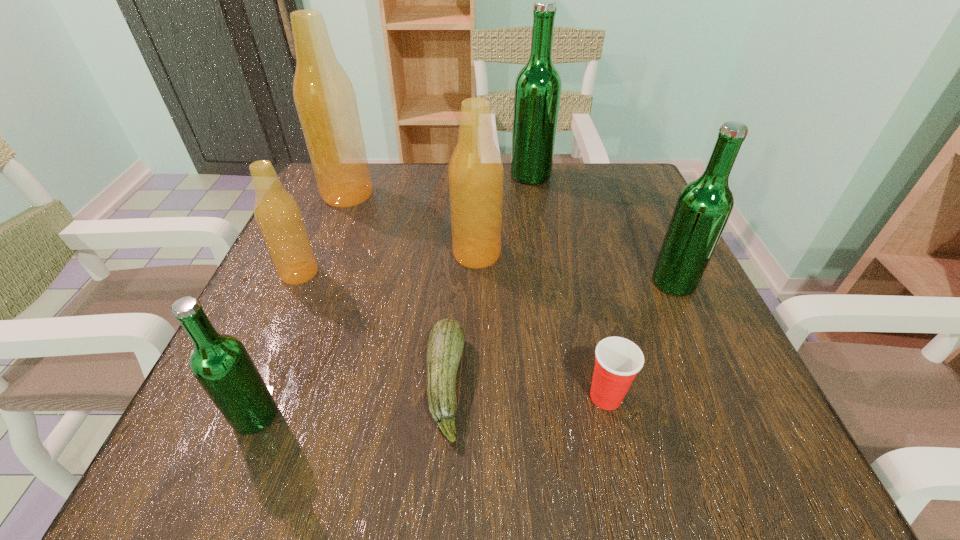
At what (x,y) coordinates should I click in order to perform the action: click on free location located 0.100m on the back of the red Dixie cup. Please return your answer as a coordinate pair (x, y). This screenshot has width=960, height=540. Looking at the image, I should click on (589, 327).

Identify the location of free space located at the stem end of the green zucchini. Image resolution: width=960 pixels, height=540 pixels. (702, 384).

Where is `beer bottle present at the near edge`? Image resolution: width=960 pixels, height=540 pixels. beer bottle present at the near edge is located at coordinates (221, 364).

Find the location of `Dixie cup that is at the near edge`. Dixie cup that is at the near edge is located at coordinates coord(618,360).

This screenshot has height=540, width=960. I want to click on zucchini that is at the near edge, so click(x=445, y=344).

Where is `object that is at the right edge`? The width and height of the screenshot is (960, 540). object that is at the right edge is located at coordinates pos(703,208).

What are the coordinates of `object at the far left corner` in the screenshot? It's located at (325, 100).

Image resolution: width=960 pixels, height=540 pixels. What are the coordinates of `object that is at the near left corner` in the screenshot? It's located at (221, 364).

Locate an element on the screen. vacant space at the far edge of the desktop is located at coordinates (394, 202).

Identify the location of free region at the near edge of the desktop. Image resolution: width=960 pixels, height=540 pixels. tap(319, 414).